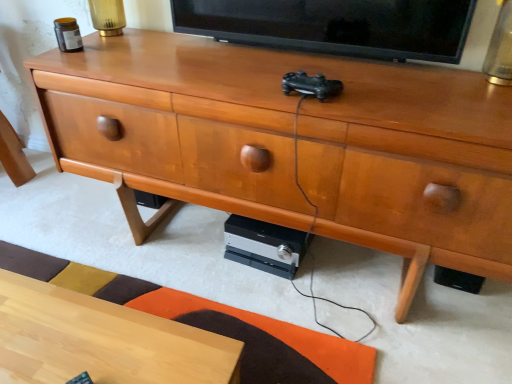
Question: Is black glossy tv at upper center closer to the viewer compared to light wood desk at lower left?

Choices:
 (A) no
 (B) yes

Answer: (A)

Question: From the image's perspective, is black glossy tv at upper center located above light wood desk at lower left?

Choices:
 (A) yes
 (B) no

Answer: (A)

Question: Considering the relative sizes of black glossy tv at upper center and light wood desk at lower left in the image provided, is black glossy tv at upper center wider than light wood desk at lower left?

Choices:
 (A) no
 (B) yes

Answer: (A)

Question: From a real-world perspective, is black glossy tv at upper center physically below light wood desk at lower left?

Choices:
 (A) yes
 (B) no

Answer: (B)

Question: Is black glossy tv at upper center oriented towards light wood desk at lower left?

Choices:
 (A) yes
 (B) no

Answer: (B)

Question: Can light wood desk at lower left be found inside black glossy tv at upper center?

Choices:
 (A) no
 (B) yes

Answer: (A)

Question: Are black glossy tv at upper center and silver/black plastic stereo at lower center far apart?

Choices:
 (A) no
 (B) yes

Answer: (A)

Question: Is black glossy tv at upper center turned away from silver/black plastic stereo at lower center?

Choices:
 (A) no
 (B) yes

Answer: (A)

Question: From a real-world perspective, is black glossy tv at upper center positioned over silver/black plastic stereo at lower center based on gravity?

Choices:
 (A) yes
 (B) no

Answer: (A)

Question: Is black glossy tv at upper center to the right of silver/black plastic stereo at lower center from the viewer's perspective?

Choices:
 (A) no
 (B) yes

Answer: (B)

Question: Is black glossy tv at upper center wider than silver/black plastic stereo at lower center?

Choices:
 (A) no
 (B) yes

Answer: (A)

Question: From the image's perspective, is black glossy tv at upper center beneath silver/black plastic stereo at lower center?

Choices:
 (A) yes
 (B) no

Answer: (B)

Question: From the image's perspective, would you say silver/black plastic stereo at lower center is shown under black glossy tv at upper center?

Choices:
 (A) yes
 (B) no

Answer: (A)